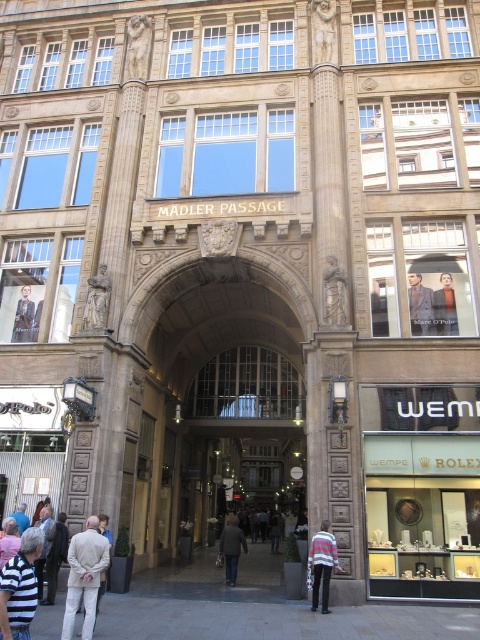
Who is shorter, striped sweater at center or dark gray suit at center?

With less height is striped sweater at center.

Is point (313, 604) closer to camera compared to point (410, 285)?

That is True.

Image resolution: width=480 pixels, height=640 pixels. Describe the element at coordinates (323, 563) in the screenshot. I see `striped sweater at center` at that location.

I want to click on striped sweater at center, so click(x=323, y=563).

Is point (31, 548) farther from viewer compared to point (420, 282)?

No, it is not.

Between point (10, 557) and point (414, 298), which one is positioned behind?

Positioned behind is point (414, 298).

I want to click on striped cotton shirt at lower left, so click(x=20, y=588).

Between smooth leather jacket at center and dark gray coat at center, which one appears on the right side from the viewer's perspective?

smooth leather jacket at center is more to the right.

Is point (446, 300) positioned before point (227, 557)?

Yes.

In order to click on smooth leather jacket at center in this screenshot , I will do `click(444, 307)`.